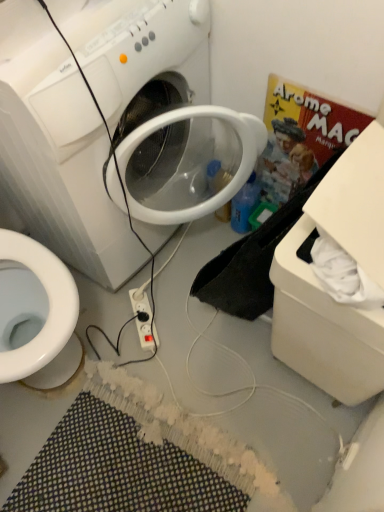
Find the location of a particular element. The width and height of the screenshot is (384, 512). free space above multicolored woven bath mat at lower center (from a real-world perspective) is located at coordinates (147, 457).